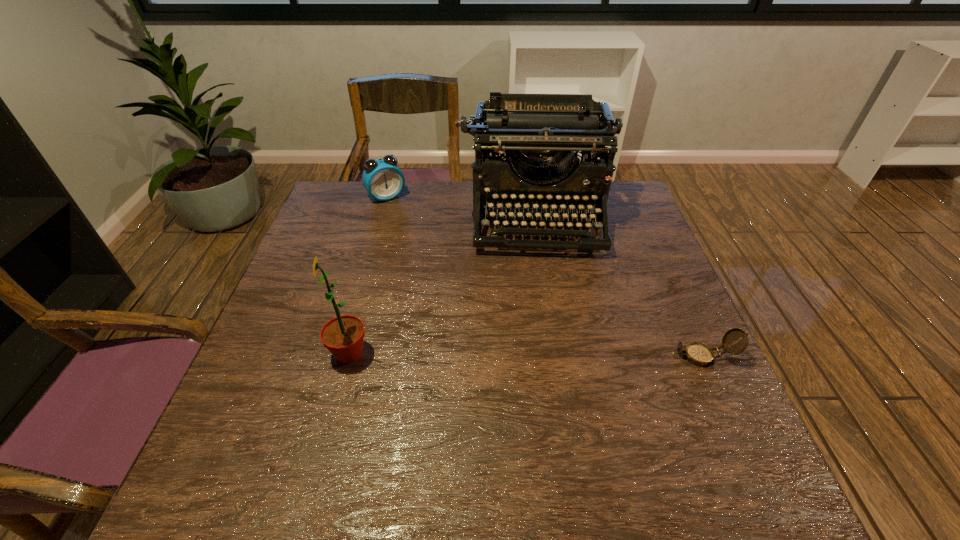
Locate an element on the screen. This screenshot has width=960, height=540. free space on the desktop that is between the sunflower and the compass and is positioned on the typing side of the typewriter is located at coordinates (551, 355).

Find the location of a particular element. The width and height of the screenshot is (960, 540). free space on the desktop that is between the sunflower and the shortest object and is positioned on the face of the alarm clock is located at coordinates (495, 355).